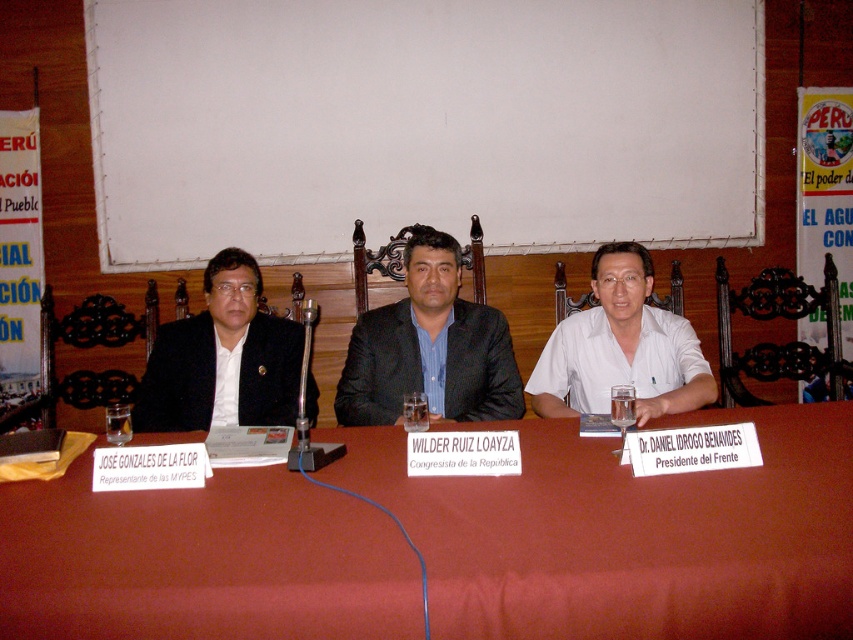
You are organizing a meeting and need to ensure that the smooth red table at center is wide enough to accommodate the matte black suit at center. Based on the image, can you determine if the table is wider than the suit?

The smooth red table at center is wider than the matte black suit at center, so yes, the table is wide enough to accommodate the suit.

You are organizing a presentation and need to place a large document on the table. The document is larger than the white cotton shirt at center. Can you fit it on the table where the white paper at upper center is located?

The white paper at upper center is bigger than the white cotton shirt at center. Since your document is larger than the white cotton shirt at center, it might be too big for the space where the white paper at upper center is located unless the white paper itself can accommodate the size. However, since the white paper is already bigger, there might be enough space. But without knowing the exact size of the document compared to the white paper, it is uncertain. However, according to the description, the area

You are a photographer positioned at the back of the room, and you want to take a photo of the white paper at upper center and the smooth red table at center. Which object will appear larger in your photo?

The white paper at upper center will appear larger in the photo because it is closer to the photographer than the smooth red table at center.